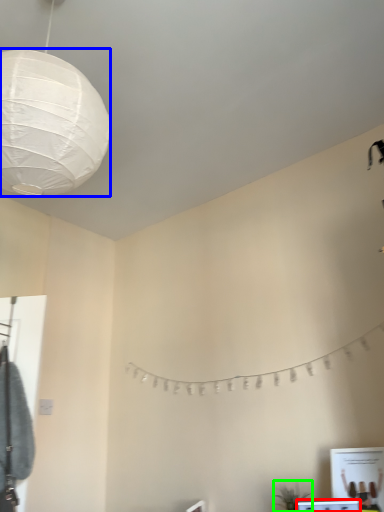
Question: Which object is positioned closest to vanity (highlighted by a red box)? Select from lantern (highlighted by a blue box) and plant (highlighted by a green box).

Choices:
 (A) lantern
 (B) plant

Answer: (B)